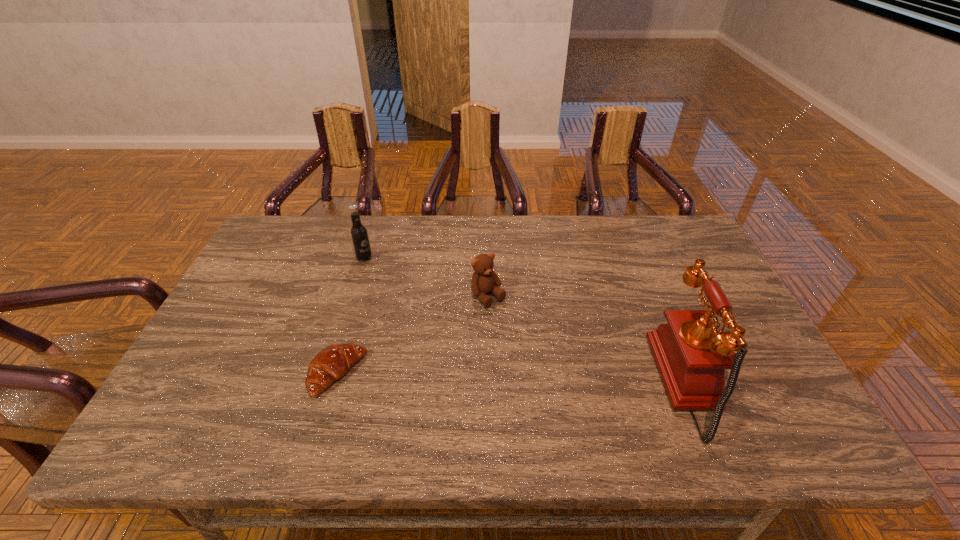
The width and height of the screenshot is (960, 540). Identify the location of blank space at the far edge of the desktop. (519, 254).

This screenshot has height=540, width=960. In the image, there is a desktop. Identify the location of vacant space at the near edge. (530, 383).

Where is `blank area at the left edge`? The width and height of the screenshot is (960, 540). blank area at the left edge is located at coordinates (284, 260).

Identify the location of vacant area at the far left corner of the desktop. (268, 237).

Locate an element on the screen. The width and height of the screenshot is (960, 540). free space between the farthest object and the telephone is located at coordinates (530, 321).

I want to click on vacant region between the third object from left to right and the shortest object, so click(413, 336).

Where is `blank region between the tallest object and the farthest object`? The image size is (960, 540). blank region between the tallest object and the farthest object is located at coordinates (530, 321).

Where is `blank region between the crescent roll and the second farthest object`? This screenshot has width=960, height=540. blank region between the crescent roll and the second farthest object is located at coordinates (413, 336).

This screenshot has width=960, height=540. I want to click on vacant space that is in between the second tallest object and the shortest object, so (x=350, y=316).

What are the coordinates of `free space that is in between the second shortest object and the shortest object` in the screenshot? It's located at (413, 336).